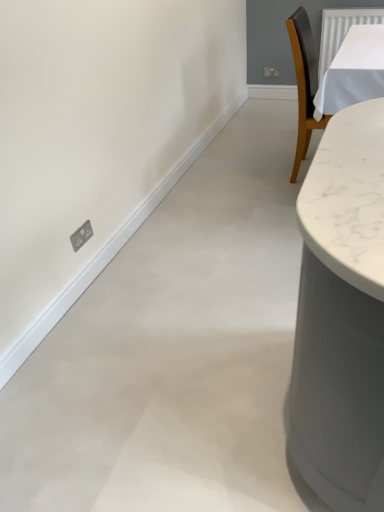
The height and width of the screenshot is (512, 384). In order to click on satin silver socket at lower left in this screenshot , I will do `click(81, 234)`.

Image resolution: width=384 pixels, height=512 pixels. Describe the element at coordinates (81, 234) in the screenshot. I see `satin silver socket at lower left` at that location.

What are the coordinates of `white matte wall at left` in the screenshot? It's located at (99, 136).

What do you see at coordinates (99, 136) in the screenshot?
I see `white matte wall at left` at bounding box center [99, 136].

In order to face white matte wall at left, should I rotate leftwards or rightwards?

To face it directly, rotate left by 1.893 degrees.

The image size is (384, 512). Find the location of `satin silver socket at lower left`. satin silver socket at lower left is located at coordinates (81, 234).

Which object is positioned more to the right, white matte wall at left or satin silver socket at lower left?

white matte wall at left is more to the right.

Which object is closer to the camera, white matte wall at left or satin silver socket at lower left?

white matte wall at left is in front.

Is point (5, 206) closer to viewer compared to point (77, 238)?

Yes.

From the image's perspective, which is above, white matte wall at left or satin silver socket at lower left?

white matte wall at left.

From a real-world perspective, is white matte wall at left beneath satin silver socket at lower left?

Correct, in the physical world, white matte wall at left is lower than satin silver socket at lower left.

Looking at their sizes, would you say white matte wall at left is wider or thinner than satin silver socket at lower left?

In the image, white matte wall at left appears to be wider than satin silver socket at lower left.

In the scene shown: Which of these two, white matte wall at left or satin silver socket at lower left, stands taller?

white matte wall at left is taller.

Who is smaller, white matte wall at left or satin silver socket at lower left?

satin silver socket at lower left.

Is white matte wall at left outside of satin silver socket at lower left?

white matte wall at left is positioned outside satin silver socket at lower left.

Can you see white matte wall at left touching satin silver socket at lower left?

No, white matte wall at left is not touching satin silver socket at lower left.

Is white matte wall at left aimed at satin silver socket at lower left?

No, white matte wall at left is not aimed at satin silver socket at lower left.

The image size is (384, 512). I want to click on backdrop below the satin silver socket at lower left (from a real-world perspective), so click(x=99, y=136).

Visually, is satin silver socket at lower left positioned to the left or to the right of white matte wall at left?

In the image, satin silver socket at lower left appears on the left side of white matte wall at left.

Is satin silver socket at lower left positioned behind white matte wall at left?

Yes, satin silver socket at lower left is further from the camera.

Considering the positions of point (80, 234) and point (95, 179), is point (80, 234) closer or farther from the camera than point (95, 179)?

Point (80, 234) is closer to the camera than point (95, 179).

From the image's perspective, does satin silver socket at lower left appear higher than white matte wall at left?

No, from the image's perspective, satin silver socket at lower left is not over white matte wall at left.

From a real-world perspective, is satin silver socket at lower left over white matte wall at left?

Yes, from a real-world perspective, satin silver socket at lower left is on top of white matte wall at left.

In terms of width, does satin silver socket at lower left look wider or thinner when compared to white matte wall at left?

satin silver socket at lower left is thinner than white matte wall at left.

Considering the relative sizes of satin silver socket at lower left and white matte wall at left in the image provided, is satin silver socket at lower left taller than white matte wall at left?

Incorrect, the height of satin silver socket at lower left is not larger of that of white matte wall at left.

Which of these two, satin silver socket at lower left or white matte wall at left, is bigger?

white matte wall at left is bigger.

Can we say satin silver socket at lower left lies outside white matte wall at left?

Yes, satin silver socket at lower left is outside of white matte wall at left.

Is satin silver socket at lower left positioned far away from white matte wall at left?

No, satin silver socket at lower left is not far away from white matte wall at left.

Does satin silver socket at lower left turn towards white matte wall at left?

No, satin silver socket at lower left is not aimed at white matte wall at left.

Based on the photo, can you tell me how much satin silver socket at lower left and white matte wall at left differ in facing direction?

0.17 degrees separate the facing orientations of satin silver socket at lower left and white matte wall at left.

Locate an element on the screen. This screenshot has height=512, width=384. backdrop that appears in front of the satin silver socket at lower left is located at coordinates (99, 136).

You are a GUI agent. You are given a task and a screenshot of the screen. Output one action in this format:
    pyautogui.click(x=<x>, y=<y>)
    Task: Click on the electric outlet behind the white matte wall at left
    This screenshot has height=512, width=384.
    Given the screenshot: What is the action you would take?
    pyautogui.click(x=81, y=234)

The width and height of the screenshot is (384, 512). What are the coordinates of `backdrop above the satin silver socket at lower left (from the image's perspective)` in the screenshot? It's located at (99, 136).